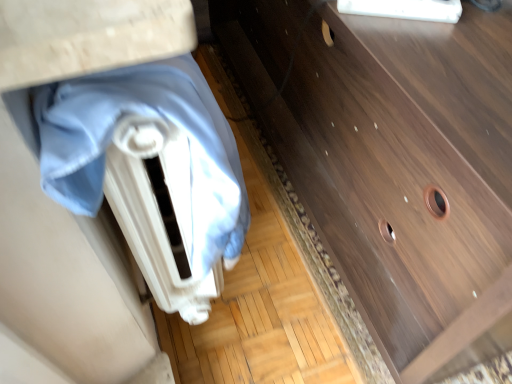
This screenshot has width=512, height=384. Identify the location of blue fabric at left. (152, 116).

What is the approximate width of blue fabric at left?

blue fabric at left is 6.34 inches wide.

Where is `wooden vanity at center`? The height and width of the screenshot is (384, 512). wooden vanity at center is located at coordinates (63, 288).

Identify the location of dark wood chest of drawers at center. (394, 167).

From their relative heights in the image, would you say wooden vanity at center is taller or shorter than blue fabric at left?

Clearly, wooden vanity at center is taller compared to blue fabric at left.

From a real-world perspective, is wooden vanity at center physically below blue fabric at left?

Yes, from a real-world perspective, wooden vanity at center is below blue fabric at left.

Is wooden vanity at center in contact with blue fabric at left?

wooden vanity at center and blue fabric at left are not in contact.

Which is behind, wooden vanity at center or blue fabric at left?

blue fabric at left is further from the camera.

Which object is positioned more to the left, dark wood chest of drawers at center or wooden vanity at center?

From the viewer's perspective, wooden vanity at center appears more on the left side.

Can you tell me how much dark wood chest of drawers at center and wooden vanity at center differ in facing direction?

0.0824 degrees.

Can you confirm if dark wood chest of drawers at center is shorter than wooden vanity at center?

Indeed, dark wood chest of drawers at center has a lesser height compared to wooden vanity at center.

Is wooden vanity at center turned away from dark wood chest of drawers at center?

That's right, wooden vanity at center is facing away from dark wood chest of drawers at center.

Considering the relative sizes of wooden vanity at center and dark wood chest of drawers at center in the image provided, is wooden vanity at center wider than dark wood chest of drawers at center?

No.

Where is `vanity that appears below the dark wood chest of drawers at center (from the image's perspective)`? vanity that appears below the dark wood chest of drawers at center (from the image's perspective) is located at coordinates (63, 288).

Is wooden vanity at center in front of dark wood chest of drawers at center?

Yes.

Consider the image. Does dark wood chest of drawers at center have a greater height compared to blue fabric at left?

Correct, dark wood chest of drawers at center is much taller as blue fabric at left.

In terms of width, does dark wood chest of drawers at center look wider or thinner when compared to blue fabric at left?

Considering their sizes, dark wood chest of drawers at center looks broader than blue fabric at left.

Are dark wood chest of drawers at center and blue fabric at left making contact?

They are not placed beside each other.

From the image's perspective, which one is positioned lower, dark wood chest of drawers at center or blue fabric at left?

blue fabric at left.

Is blue fabric at left positioned with its back to dark wood chest of drawers at center?

No, dark wood chest of drawers at center is not at the back of blue fabric at left.

Can you tell me how much blue fabric at left and dark wood chest of drawers at center differ in facing direction?

There is a 0.0806-degree angle between the facing directions of blue fabric at left and dark wood chest of drawers at center.

Is blue fabric at left inside or outside of dark wood chest of drawers at center?

blue fabric at left is not enclosed by dark wood chest of drawers at center.

Which point is more distant from viewer, [214,204] or [418,381]?

The point [418,381] is more distant.

This screenshot has width=512, height=384. I want to click on vanity in front of the blue fabric at left, so click(x=63, y=288).

Considering the positions of point (206, 195) and point (31, 60), is point (206, 195) closer or farther from the camera than point (31, 60)?

Point (206, 195) is positioned farther from the camera compared to point (31, 60).

Which object is positioned more to the left, blue fabric at left or wooden vanity at center?

blue fabric at left.

The image size is (512, 384). There is a wooden vanity at center. Identify the location of blanket above it (from a real-world perspective). coord(152,116).

Locate an element on the screen. the chest of drawers directly beneath the wooden vanity at center (from a real-world perspective) is located at coordinates tap(394, 167).

Considering their positions, is dark wood chest of drawers at center positioned closer to wooden vanity at center than blue fabric at left?

Based on the image, blue fabric at left appears to be nearer to wooden vanity at center.

Estimate the real-world distances between objects in this image. Which object is further from wooden vanity at center, blue fabric at left or dark wood chest of drawers at center?

dark wood chest of drawers at center is further to wooden vanity at center.

Considering their positions, is wooden vanity at center positioned further to blue fabric at left than dark wood chest of drawers at center?

dark wood chest of drawers at center.

Based on their spatial positions, is wooden vanity at center or blue fabric at left further from dark wood chest of drawers at center?

The object further to dark wood chest of drawers at center is wooden vanity at center.

Considering their positions, is blue fabric at left positioned further to dark wood chest of drawers at center than wooden vanity at center?

wooden vanity at center is positioned further to the anchor dark wood chest of drawers at center.

Estimate the real-world distances between objects in this image. Which object is closer to blue fabric at left, dark wood chest of drawers at center or wooden vanity at center?

Among the two, wooden vanity at center is located nearer to blue fabric at left.

This screenshot has height=384, width=512. I want to click on vanity between blue fabric at left and dark wood chest of drawers at center in the horizontal direction, so click(x=63, y=288).